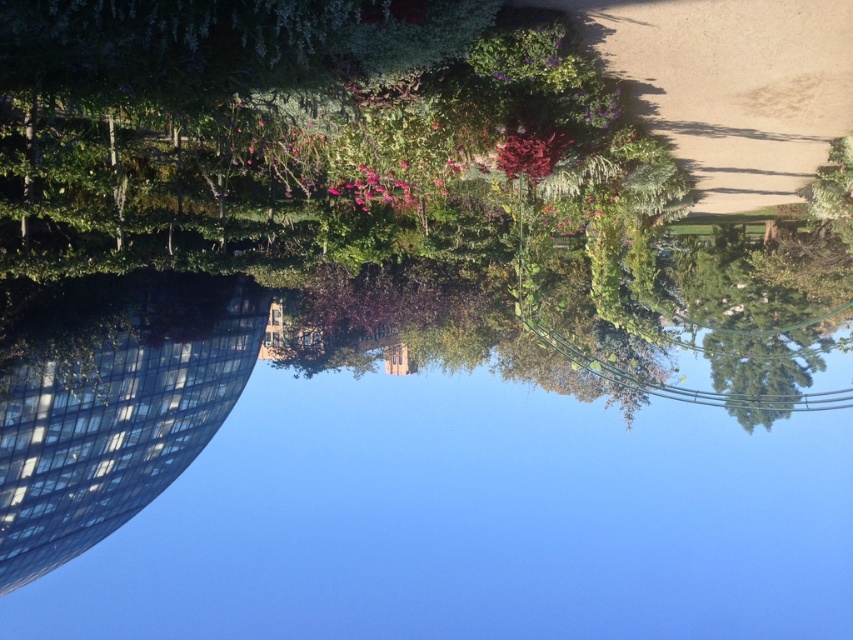
Does transparent glass water at center have a lesser width compared to green leafy tree at center?

No.

At what (x,y) coordinates should I click in order to perform the action: click on transparent glass water at center. Please return your answer as a coordinate pair (x, y). Looking at the image, I should click on (431, 451).